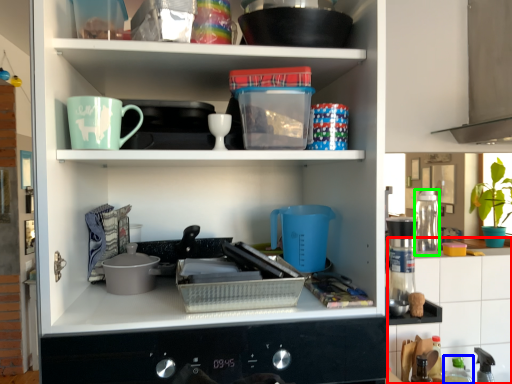
Question: Estimate the real-world distances between objects in this image. Which object is closer to counter top (highlighted by a red box), bottle (highlighted by a blue box) or appliance (highlighted by a green box)?

Choices:
 (A) bottle
 (B) appliance

Answer: (A)